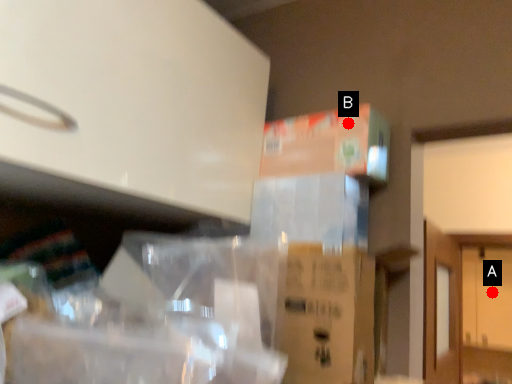
Question: Two points are circled on the image, labeled by A and B beside each circle. Among these points, which one is nearest to the camera?

Choices:
 (A) A is closer
 (B) B is closer

Answer: (B)